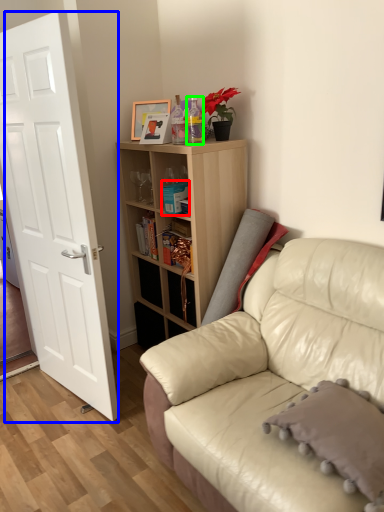
Question: Based on their relative distances, which object is farther from book (highlighted by a red box)? Choose from door (highlighted by a blue box) and bottle (highlighted by a green box).

Choices:
 (A) door
 (B) bottle

Answer: (A)